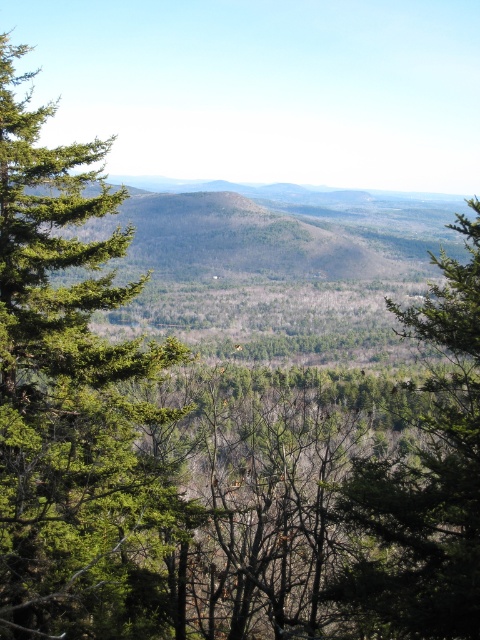
Which is more to the right, green needle-like tree at left or green matte tree at center?

green matte tree at center

Which is below, green needle-like tree at left or green matte tree at center?

green matte tree at center

Which is behind, point (129, 417) or point (464, 273)?

The point (464, 273) is more distant.

Identify the location of green needle-like tree at left. (72, 403).